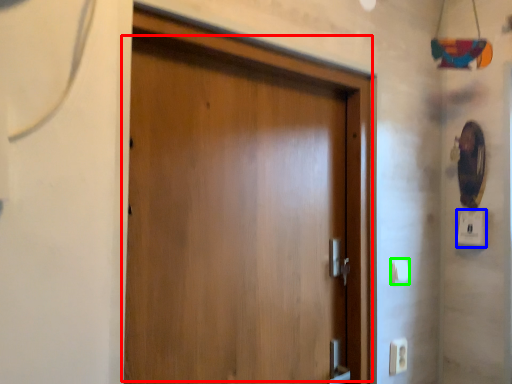
Question: Which is nearer to the door (highlighted by a red box)? light switch (highlighted by a blue box) or light switch (highlighted by a green box).

Choices:
 (A) light switch
 (B) light switch

Answer: (B)